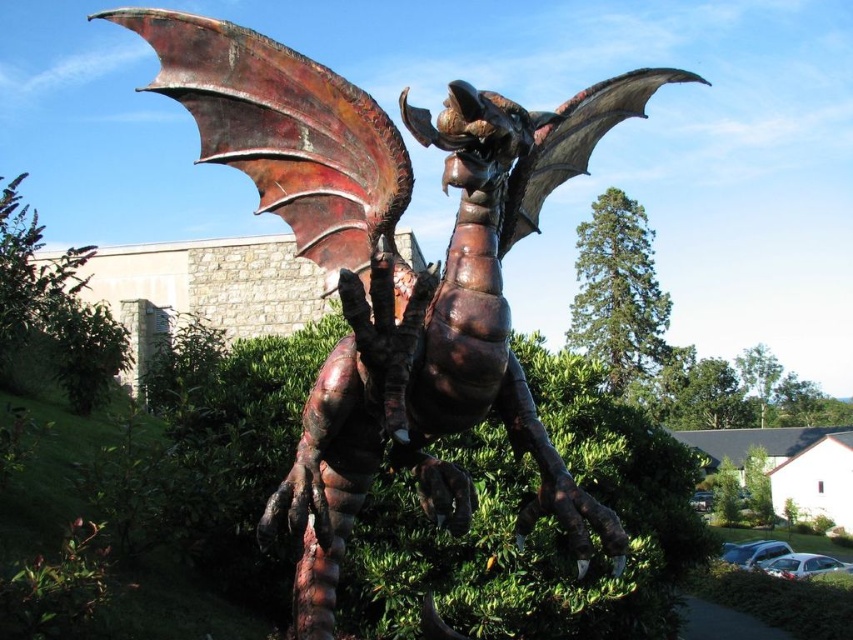
You are standing in front of the rusty metal dragon at center and want to take a photo with your camera. If the camera is 9.02 feet away from the dragon, will you be able to capture the entire dragon in the frame?

The rusty metal dragon at center and camera are 9.02 feet apart from each other. Since the camera is positioned at this distance, it is possible to capture the entire dragon in the frame, assuming the camera has an appropriate wide enough lens to accommodate the dragon sculpture at that distance.

You are standing in front of the dragon sculpture and want to place a small garden ornament at the point marked by the coordinates point (x=51, y=310). What is currently located at that point?

The green leafy bush at lower left is located at point (x=51, y=310).

You are standing in front of the dragon sculpture and notice two points on its surface. The first point is at coordinate point (200, 49) and the second is at point (4, 369). Which point is closer to your current position?

Point (200, 49) is closer to the viewer than point (4, 369).